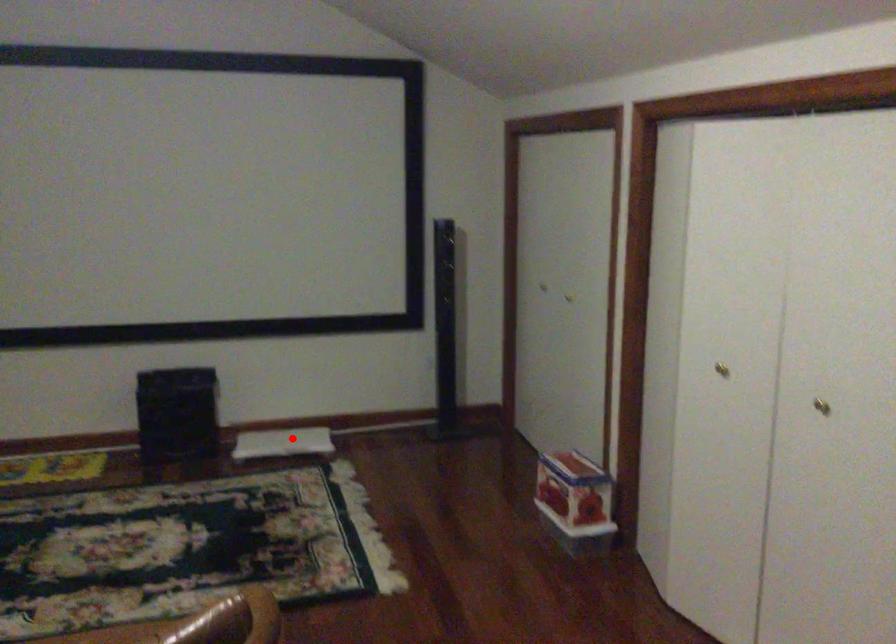
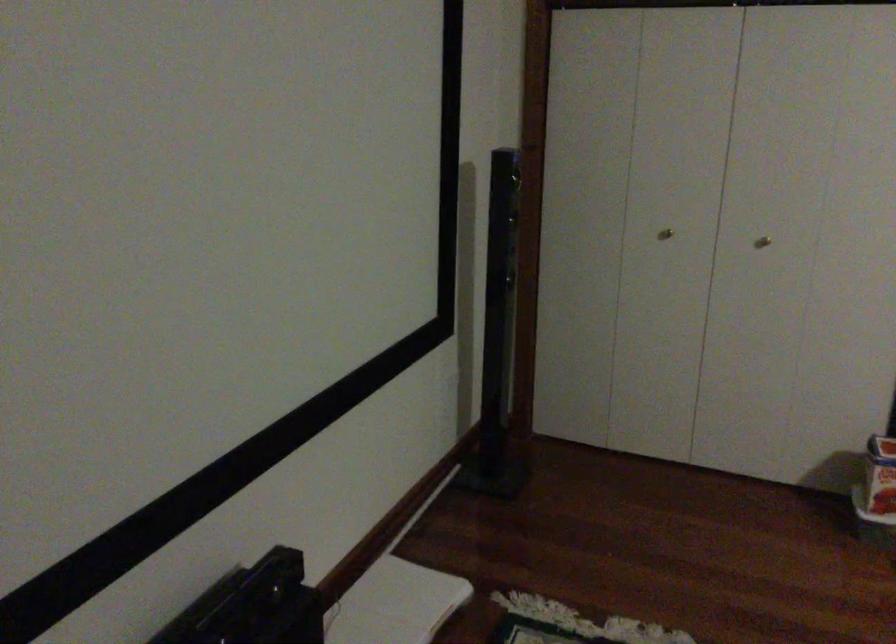
The point at the highlighted location is marked in the first image. Where is the corresponding point in the second image?

(394, 603)